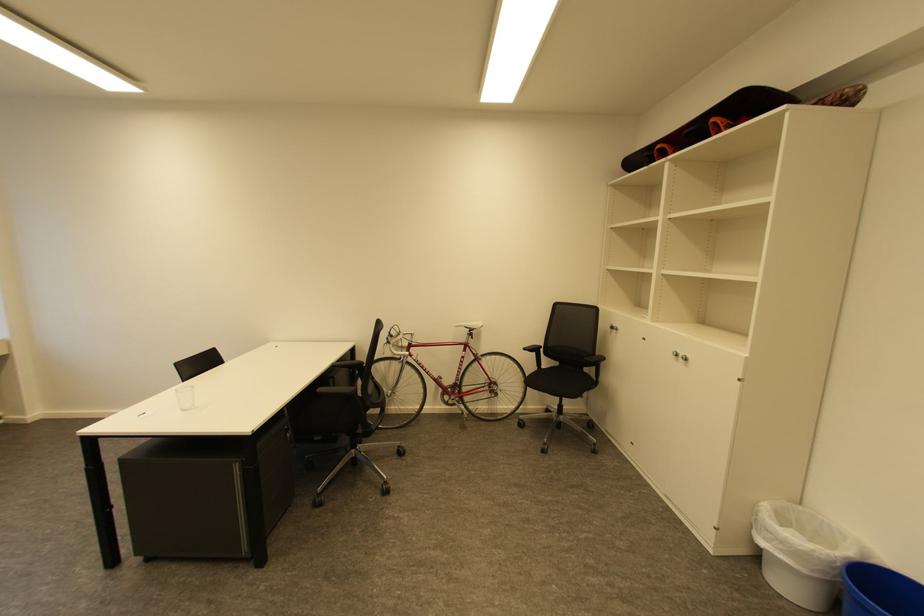
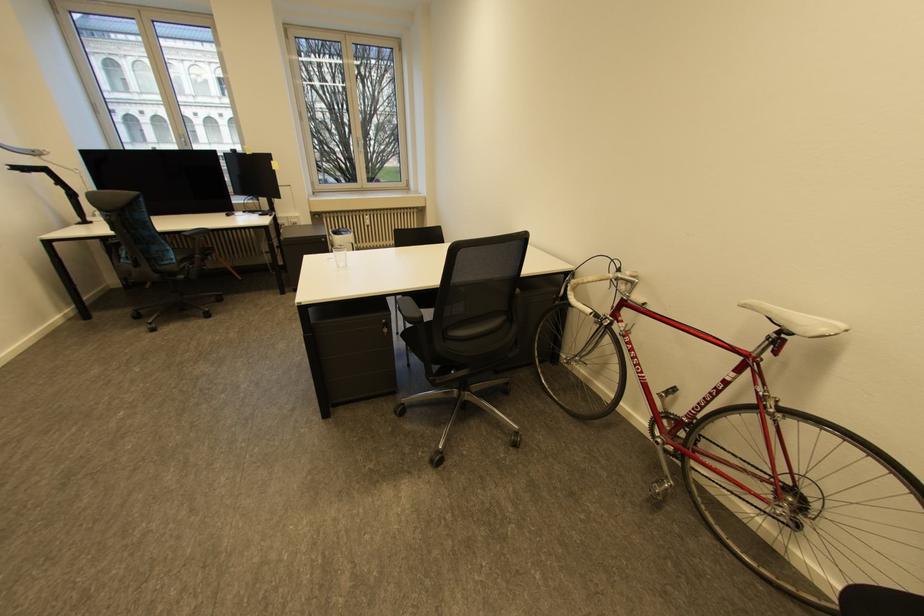
In the second image, find the point that corresponds to point (478, 331) in the first image.

(789, 331)